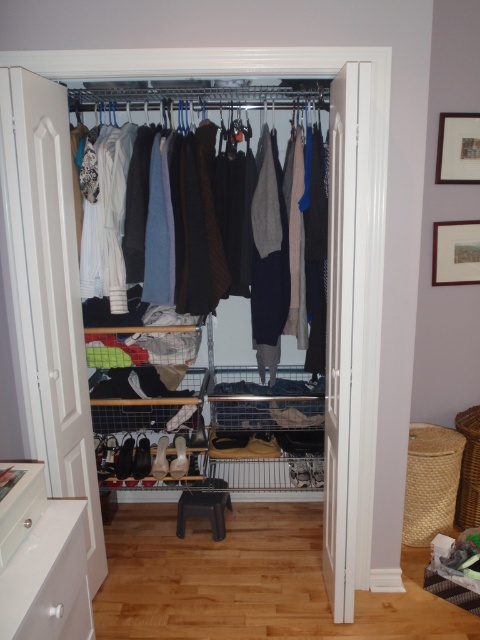
Between metallic wire rack at center and knit sweater at center, which one appears on the left side from the viewer's perspective?

From the viewer's perspective, knit sweater at center appears more on the left side.

Is metallic wire rack at center above knit sweater at center?

Incorrect, metallic wire rack at center is not positioned above knit sweater at center.

Between point (218, 49) and point (282, 209), which one is positioned behind?

The point (282, 209) is behind.

Identify the location of metallic wire rack at center. (328, 259).